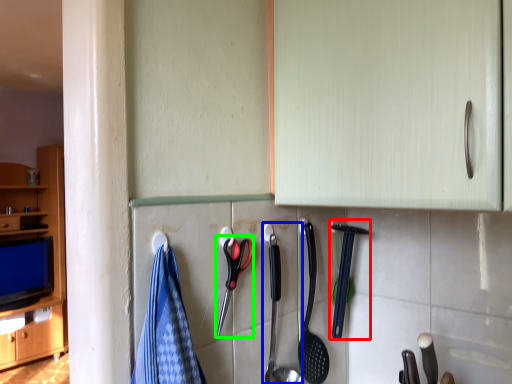
Question: Which object is positioned farthest from silverware (highlighted by a red box)? Select from silverware (highlighted by a blue box) and scissors (highlighted by a green box).

Choices:
 (A) silverware
 (B) scissors

Answer: (B)